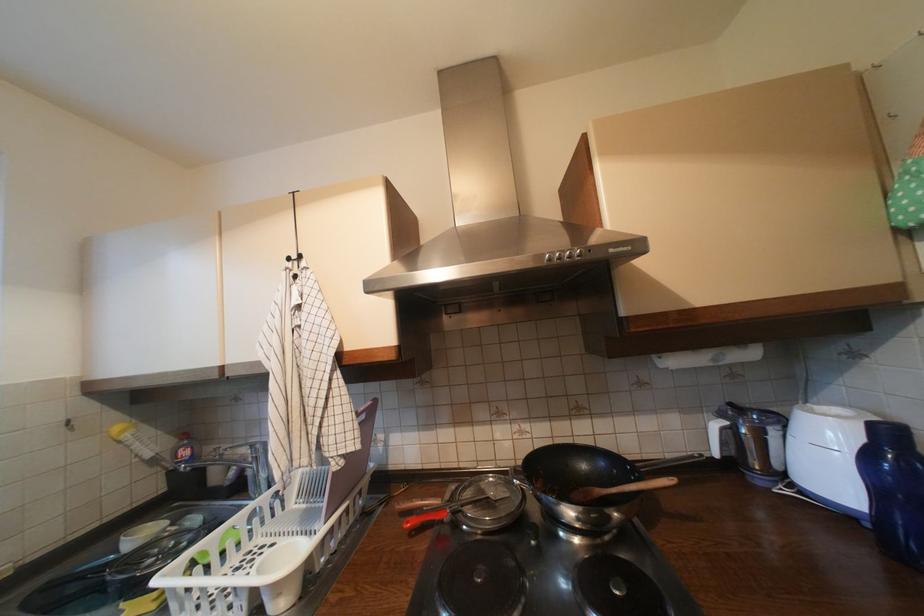
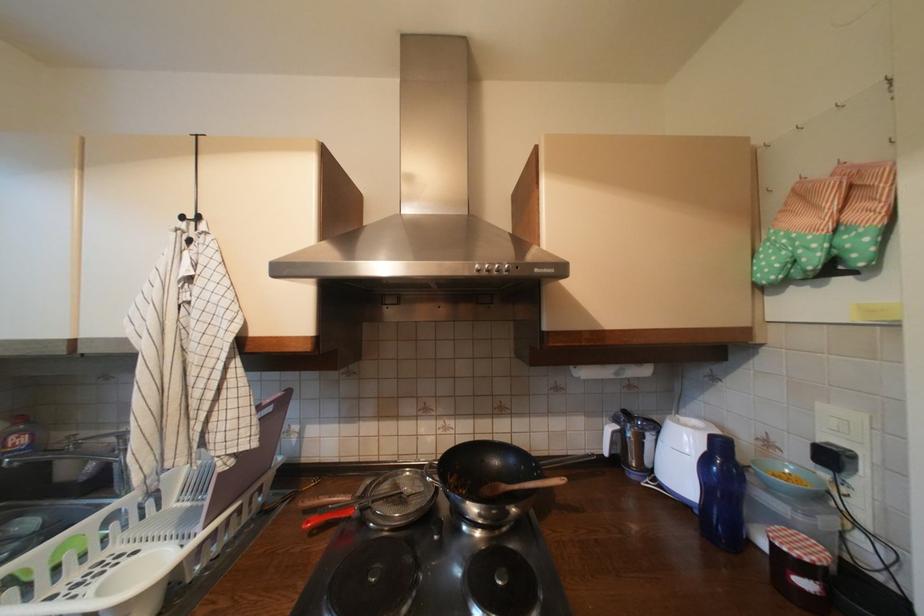
Find the pixel in the second image that matches [623,492] in the first image.

(525, 488)